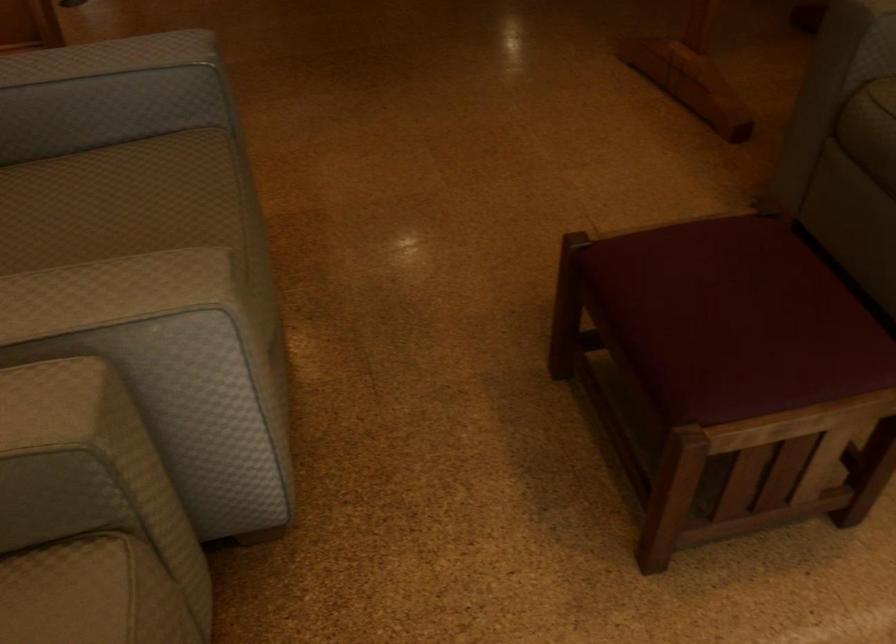
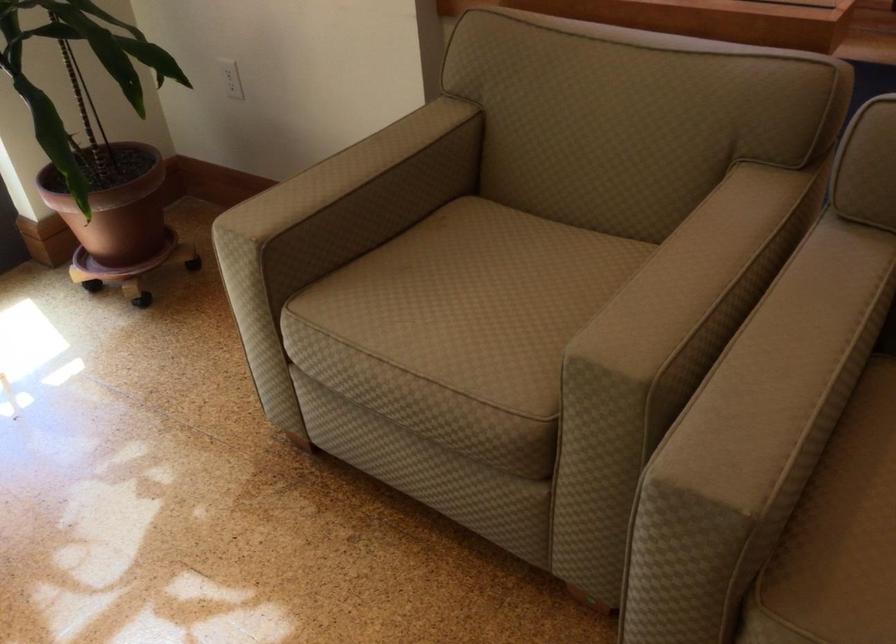
The point at (87,281) is marked in the first image. Where is the corresponding point in the second image?

(773, 399)